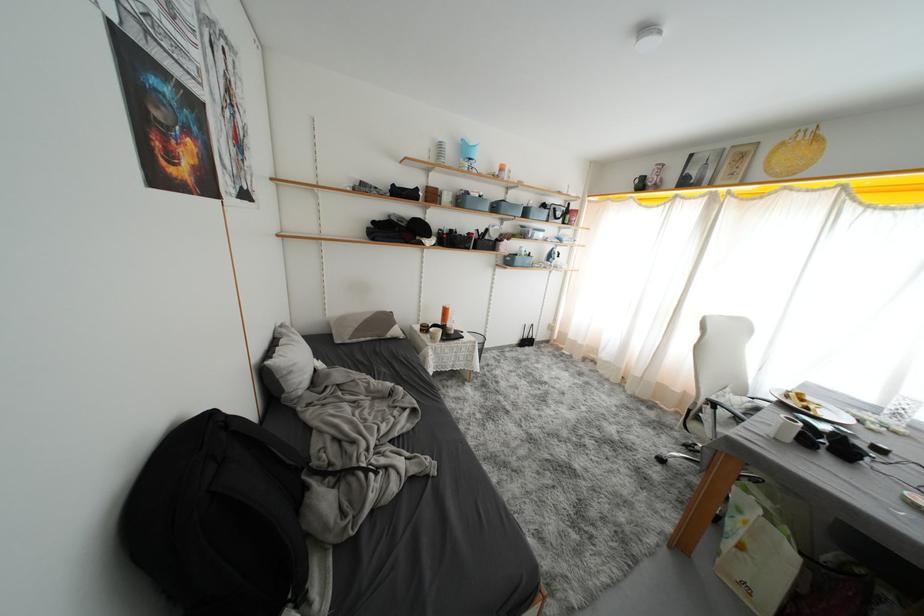
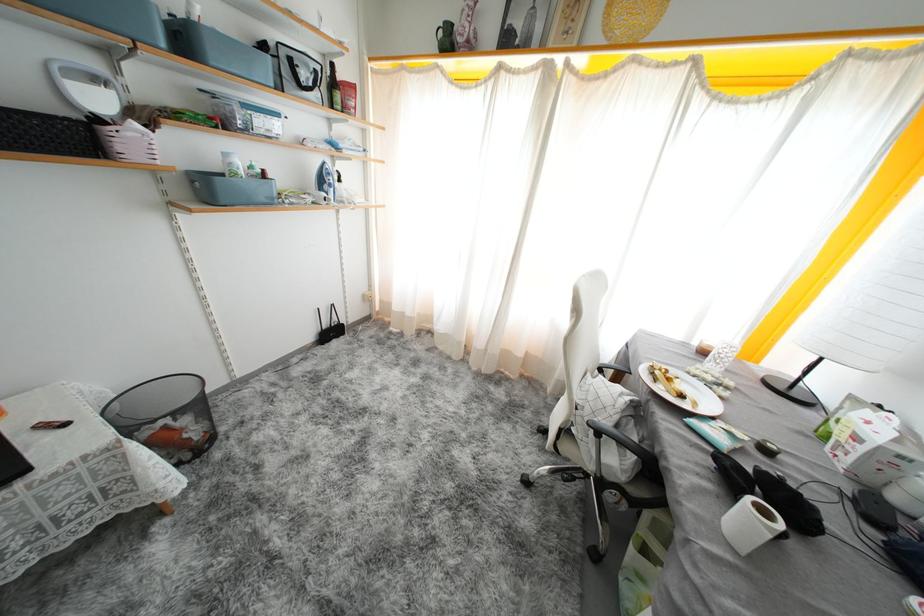
The point at (x=813, y=411) is marked in the first image. Where is the corresponding point in the second image?

(687, 400)